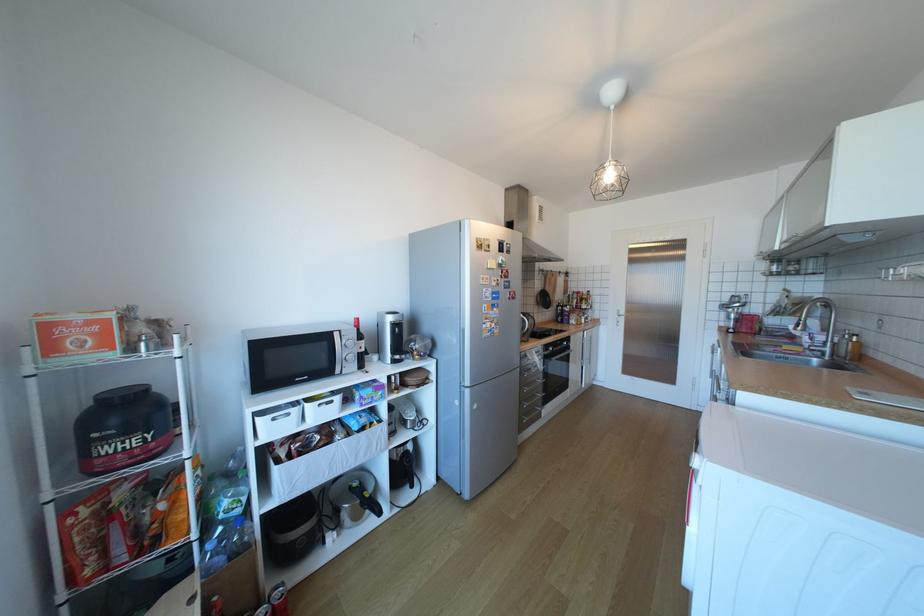
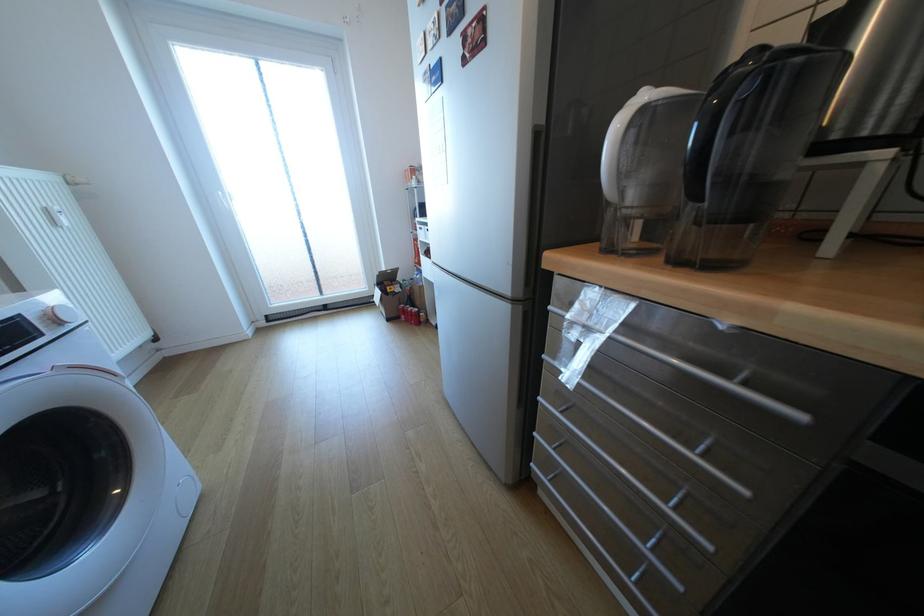
Question: I am providing you with two images of the same scene from different viewpoints. Please identify which objects are invisible in image2.

Choices:
 (A) red soda can
 (B) metallic dish
 (C) metal drawer handle
 (D) microwave door handle

Answer: (D)